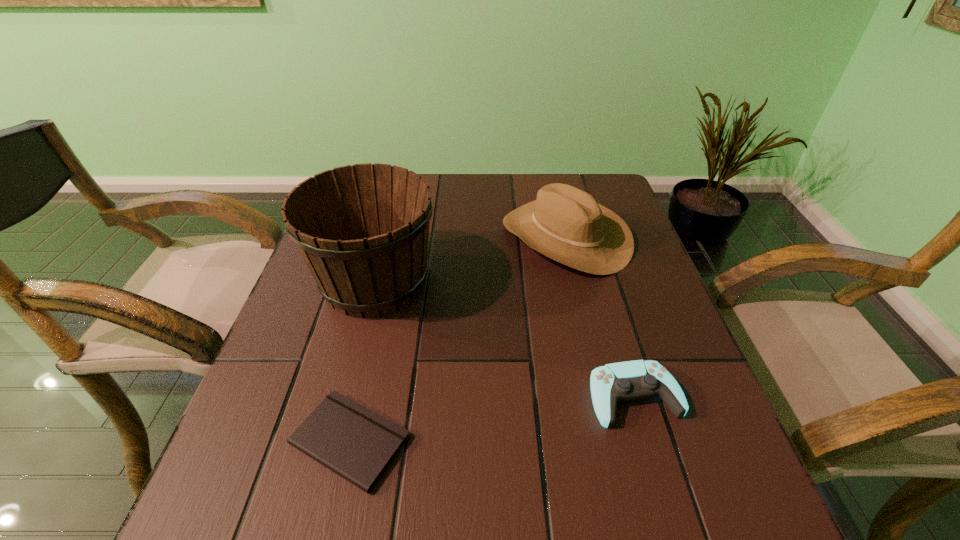
The image size is (960, 540). What are the coordinates of `wine bucket at the left edge` in the screenshot? It's located at (363, 230).

Where is `checkbook present at the left edge`? The width and height of the screenshot is (960, 540). checkbook present at the left edge is located at coordinates (351, 440).

Identify the location of cowboy hat present at the right edge. The image size is (960, 540). (566, 224).

At what (x,y) coordinates should I click in order to perform the action: click on control that is at the right edge. Please return your answer as a coordinate pair (x, y). The width and height of the screenshot is (960, 540). Looking at the image, I should click on (624, 381).

Locate an element on the screen. object at the near left corner is located at coordinates (351, 440).

Image resolution: width=960 pixels, height=540 pixels. Identify the location of object that is at the far right corner. (566, 224).

At what (x,y) coordinates should I click in order to perform the action: click on vacant space at the far edge. Please return your answer as a coordinate pair (x, y). Image resolution: width=960 pixels, height=540 pixels. Looking at the image, I should click on (455, 215).

Where is `free space at the near edge`? free space at the near edge is located at coordinates (641, 518).

Find the location of a particular element. This screenshot has width=960, height=540. free space at the left edge of the desktop is located at coordinates (264, 393).

Image resolution: width=960 pixels, height=540 pixels. What are the coordinates of `vacant space at the right edge` in the screenshot? It's located at (636, 428).